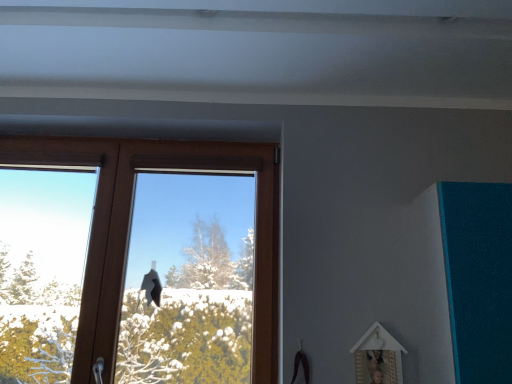
Question: Is wooden picture frame at lower right oriented away from brown wooden window at center?

Choices:
 (A) yes
 (B) no

Answer: (B)

Question: Can you confirm if wooden picture frame at lower right is bigger than brown wooden window at center?

Choices:
 (A) no
 (B) yes

Answer: (A)

Question: From the image's perspective, is wooden picture frame at lower right on top of brown wooden window at center?

Choices:
 (A) no
 (B) yes

Answer: (A)

Question: Is wooden picture frame at lower right far away from brown wooden window at center?

Choices:
 (A) yes
 (B) no

Answer: (B)

Question: From a real-world perspective, is wooden picture frame at lower right beneath brown wooden window at center?

Choices:
 (A) yes
 (B) no

Answer: (A)

Question: Can you confirm if wooden picture frame at lower right is taller than brown wooden window at center?

Choices:
 (A) no
 (B) yes

Answer: (A)

Question: Is brown wooden window at center oriented away from wooden picture frame at lower right?

Choices:
 (A) no
 (B) yes

Answer: (A)

Question: Is brown wooden window at center positioned far away from wooden picture frame at lower right?

Choices:
 (A) yes
 (B) no

Answer: (B)

Question: Could you tell me if brown wooden window at center is turned towards wooden picture frame at lower right?

Choices:
 (A) no
 (B) yes

Answer: (A)

Question: Is brown wooden window at center located outside wooden picture frame at lower right?

Choices:
 (A) yes
 (B) no

Answer: (A)

Question: From a real-world perspective, is brown wooden window at center under wooden picture frame at lower right?

Choices:
 (A) no
 (B) yes

Answer: (A)

Question: Can you confirm if brown wooden window at center is shorter than wooden picture frame at lower right?

Choices:
 (A) no
 (B) yes

Answer: (A)

Question: Visually, is wooden picture frame at lower right positioned to the left or to the right of brown wooden window at center?

Choices:
 (A) right
 (B) left

Answer: (A)